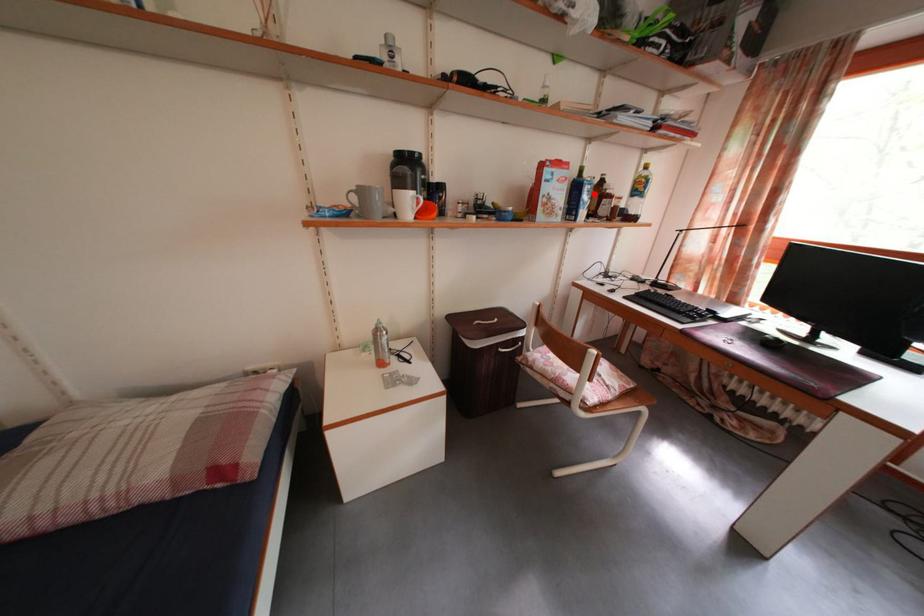
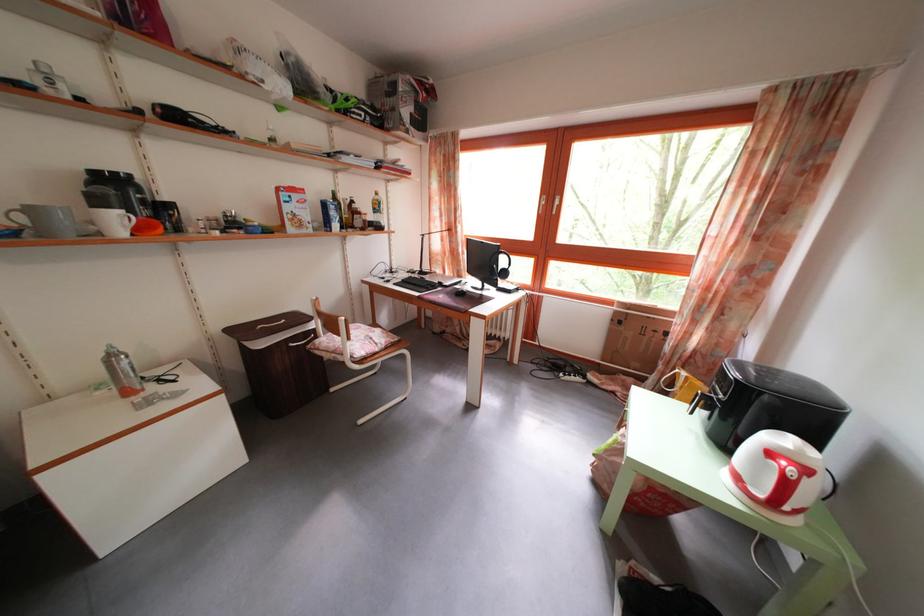
Find the pixel in the second image that matches the highlighted location in the first image.

(338, 214)